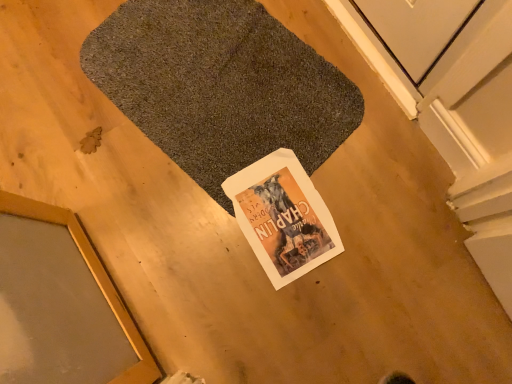
At what (x,y) coordinates should I click in order to perform the action: click on blank area to the left of white paper magazine at center. Please return your answer as a coordinate pair (x, y). Looking at the image, I should click on (195, 237).